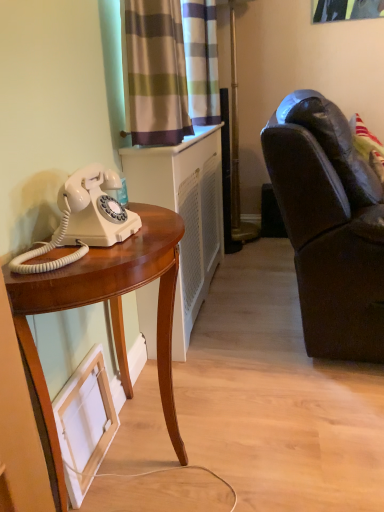
Identify the location of free region under mahogany wood desk at left (from a real-world perspective). The width and height of the screenshot is (384, 512). (142, 451).